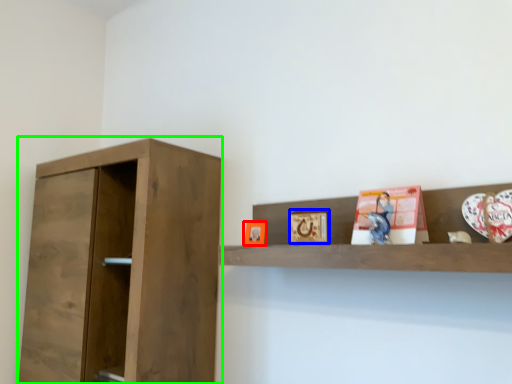
Question: Considering the real-world distances, which object is farthest from picture frame (highlighted by a red box)? picture frame (highlighted by a blue box) or cupboard (highlighted by a green box)?

Choices:
 (A) picture frame
 (B) cupboard

Answer: (B)